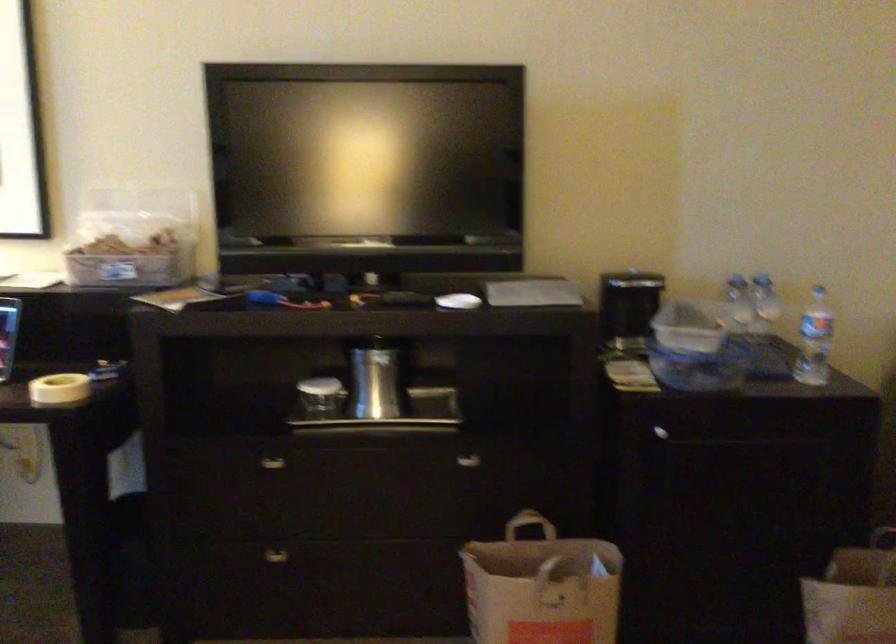
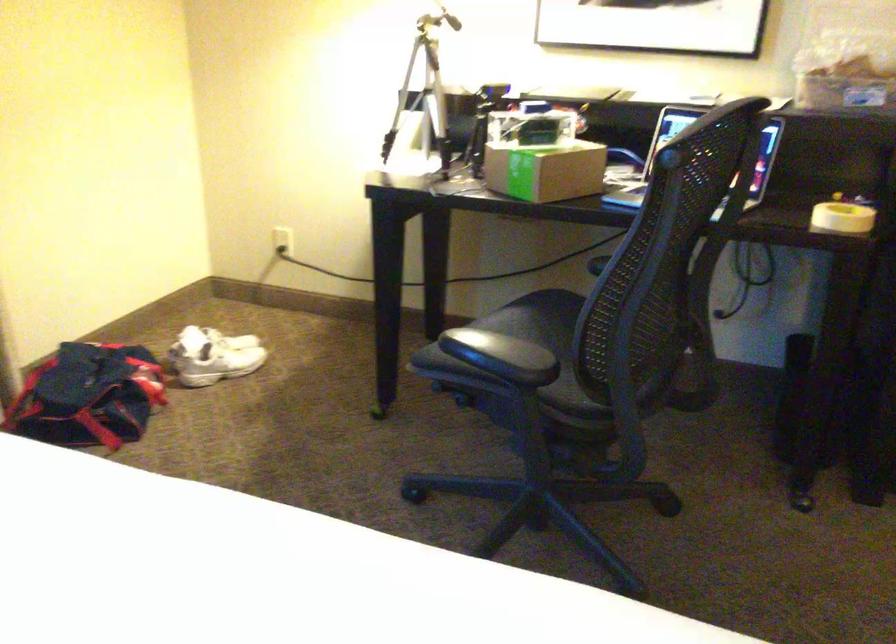
Question: In a continuous first-person perspective shot, in which direction is the camera moving?

Choices:
 (A) Left
 (B) Right
 (C) Forward
 (D) Backward

Answer: (A)